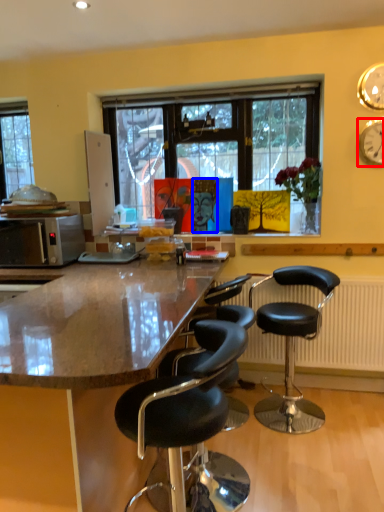
Question: Which of the following is the closest to the observer, clock (highlighted by a red box) or person (highlighted by a blue box)?

Choices:
 (A) clock
 (B) person

Answer: (A)